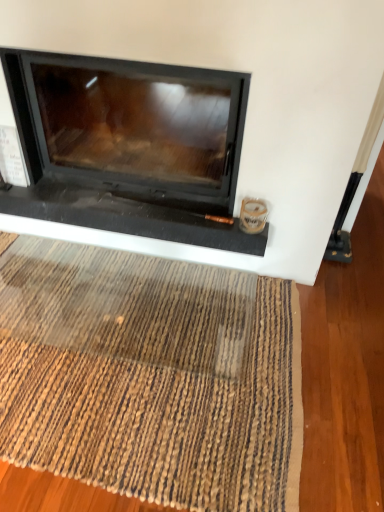
What do you see at coordinates (129, 147) in the screenshot? The height and width of the screenshot is (512, 384). I see `black glass fireplace at center` at bounding box center [129, 147].

What is the approximate height of black glass fireplace at center?

It is 1.04 meters.

In order to face black glass fireplace at center, should I rotate leftwards or rightwards?

Rotate left and turn 8.518 degrees.

This screenshot has width=384, height=512. In order to click on black glass fireplace at center in this screenshot , I will do `click(129, 147)`.

Measure the distance between brown woven mat at lower center and camera.

brown woven mat at lower center and camera are 3.75 feet apart.

What is the approximate height of brown woven mat at lower center?

It is 0.94 inches.

Where is `brown woven mat at lower center`? This screenshot has height=512, width=384. brown woven mat at lower center is located at coordinates (151, 376).

Describe the element at coordinates (151, 376) in the screenshot. The image size is (384, 512). I see `brown woven mat at lower center` at that location.

This screenshot has width=384, height=512. I want to click on black glass fireplace at center, so point(129,147).

Which is more to the left, brown woven mat at lower center or black glass fireplace at center?

brown woven mat at lower center is more to the left.

Looking at this image, is the depth of brown woven mat at lower center less than that of black glass fireplace at center?

Yes, brown woven mat at lower center is in front of black glass fireplace at center.

Is point (199, 369) behind point (53, 190)?

No, it is not.

From the image's perspective, is brown woven mat at lower center located above or below black glass fireplace at center?

brown woven mat at lower center is situated lower than black glass fireplace at center in the image.

Based on the photo, from a real-world perspective, is brown woven mat at lower center located higher than black glass fireplace at center?

No, from a real-world perspective, brown woven mat at lower center is not on top of black glass fireplace at center.

Considering the relative sizes of brown woven mat at lower center and black glass fireplace at center in the image provided, is brown woven mat at lower center thinner than black glass fireplace at center?

Incorrect, the width of brown woven mat at lower center is not less than that of black glass fireplace at center.

From their relative heights in the image, would you say brown woven mat at lower center is taller or shorter than black glass fireplace at center?

In the image, brown woven mat at lower center appears to be shorter than black glass fireplace at center.

Can you confirm if brown woven mat at lower center is smaller than black glass fireplace at center?

Indeed, brown woven mat at lower center has a smaller size compared to black glass fireplace at center.

Is brown woven mat at lower center completely or partially outside of black glass fireplace at center?

Yes, brown woven mat at lower center is outside of black glass fireplace at center.

Is brown woven mat at lower center in contact with black glass fireplace at center?

No.

Is brown woven mat at lower center facing towards black glass fireplace at center?

No, brown woven mat at lower center is not turned towards black glass fireplace at center.

What's the angular difference between brown woven mat at lower center and black glass fireplace at center's facing directions?

The angular difference between brown woven mat at lower center and black glass fireplace at center is 0.643 degrees.

What are the coordinates of `mat in front of the black glass fireplace at center` in the screenshot? It's located at (151, 376).

Based on their positions, is black glass fireplace at center located to the left or right of brown woven mat at lower center?

From the image, it's evident that black glass fireplace at center is to the right of brown woven mat at lower center.

Considering the positions of objects black glass fireplace at center and brown woven mat at lower center in the image provided, who is in front, black glass fireplace at center or brown woven mat at lower center?

brown woven mat at lower center is in front.

Which is nearer, (143, 98) or (37, 365)?

Point (143, 98) is positioned farther from the camera compared to point (37, 365).

From the image's perspective, does black glass fireplace at center appear higher than brown woven mat at lower center?

Yes, from the image's perspective, black glass fireplace at center is on top of brown woven mat at lower center.

From a real-world perspective, is black glass fireplace at center located higher than brown woven mat at lower center?

Yes, from a real-world perspective, black glass fireplace at center is on top of brown woven mat at lower center.

Can you confirm if black glass fireplace at center is wider than brown woven mat at lower center?

Incorrect, the width of black glass fireplace at center does not surpass that of brown woven mat at lower center.

Which of these two, black glass fireplace at center or brown woven mat at lower center, stands taller?

black glass fireplace at center is taller.

Considering the sizes of objects black glass fireplace at center and brown woven mat at lower center in the image provided, who is bigger, black glass fireplace at center or brown woven mat at lower center?

Bigger between the two is black glass fireplace at center.

Choose the correct answer: Is black glass fireplace at center inside brown woven mat at lower center or outside it?

black glass fireplace at center is not inside brown woven mat at lower center, it's outside.

Are black glass fireplace at center and brown woven mat at lower center beside each other?

No, black glass fireplace at center is not in contact with brown woven mat at lower center.

Is black glass fireplace at center turned away from brown woven mat at lower center?

No, brown woven mat at lower center is not at the back of black glass fireplace at center.

Identify the location of mat that is on the left side of black glass fireplace at center. (151, 376).

I want to click on mat below the black glass fireplace at center (from the image's perspective), so click(x=151, y=376).

Identify the location of fireplace located behind the brown woven mat at lower center. (129, 147).